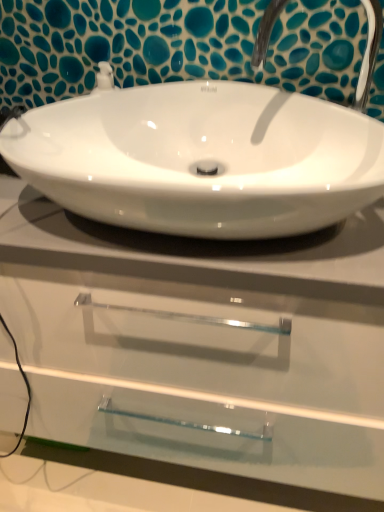
Question: Is the position of satin nickel faucet at upper center more distant than that of white glossy countertop at center?

Choices:
 (A) no
 (B) yes

Answer: (B)

Question: Is satin nickel faucet at upper center in front of white glossy countertop at center?

Choices:
 (A) yes
 (B) no

Answer: (B)

Question: Would you consider satin nickel faucet at upper center to be distant from white glossy countertop at center?

Choices:
 (A) no
 (B) yes

Answer: (A)

Question: Is satin nickel faucet at upper center smaller than white glossy countertop at center?

Choices:
 (A) yes
 (B) no

Answer: (A)

Question: Does satin nickel faucet at upper center appear on the right side of white glossy countertop at center?

Choices:
 (A) yes
 (B) no

Answer: (A)

Question: Considering the relative sizes of satin nickel faucet at upper center and white glossy countertop at center in the image provided, is satin nickel faucet at upper center bigger than white glossy countertop at center?

Choices:
 (A) no
 (B) yes

Answer: (A)

Question: Is white glossy sink at center placed right next to satin nickel faucet at upper center?

Choices:
 (A) no
 (B) yes

Answer: (A)

Question: Considering the relative positions of white glossy sink at center and satin nickel faucet at upper center in the image provided, is white glossy sink at center behind satin nickel faucet at upper center?

Choices:
 (A) no
 (B) yes

Answer: (A)

Question: From the image's perspective, would you say white glossy sink at center is positioned over satin nickel faucet at upper center?

Choices:
 (A) yes
 (B) no

Answer: (B)

Question: Can we say white glossy sink at center lies outside satin nickel faucet at upper center?

Choices:
 (A) no
 (B) yes

Answer: (B)

Question: Is white glossy sink at center in front of satin nickel faucet at upper center?

Choices:
 (A) no
 (B) yes

Answer: (B)

Question: Can you confirm if white glossy sink at center is thinner than satin nickel faucet at upper center?

Choices:
 (A) yes
 (B) no

Answer: (B)

Question: From a real-world perspective, is white glossy sink at center located beneath white glossy countertop at center?

Choices:
 (A) no
 (B) yes

Answer: (A)